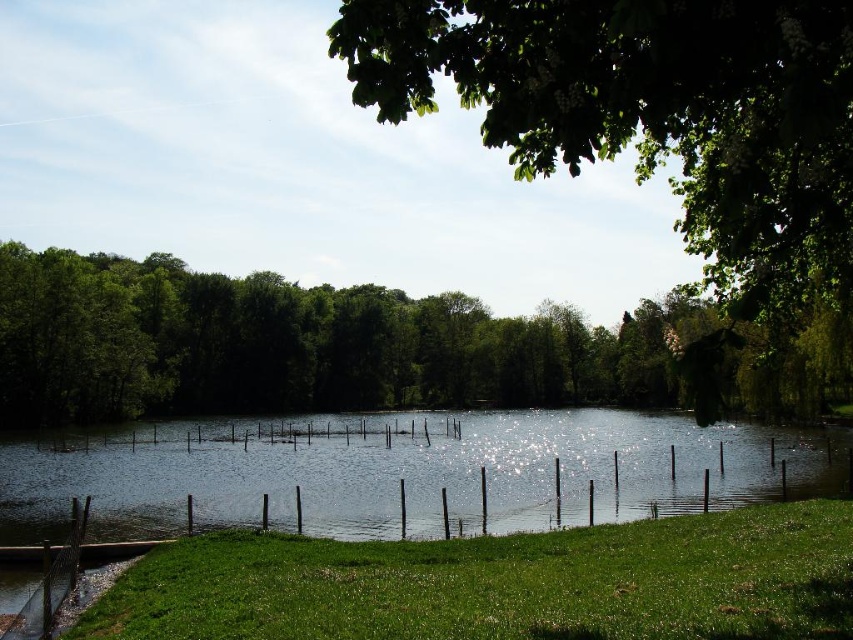
Does green leafy tree at upper right appear under green grass at lower left?

No.

This screenshot has height=640, width=853. What do you see at coordinates (653, 122) in the screenshot? I see `green leafy tree at upper right` at bounding box center [653, 122].

Where is `green leafy tree at upper right`? green leafy tree at upper right is located at coordinates (653, 122).

Between point (811, 323) and point (320, 419), which one is positioned behind?

Positioned behind is point (320, 419).

Does point (16, 284) lie behind point (207, 508)?

Yes.

The image size is (853, 640). I want to click on green leafy tree at center, so click(x=373, y=348).

The width and height of the screenshot is (853, 640). I want to click on green leafy tree at center, so click(x=373, y=348).

Who is shorter, green leafy tree at upper right or clear water at center?

green leafy tree at upper right

Between point (577, 40) and point (717, 461), which one is positioned behind?

The point (717, 461) is behind.

Where is `green leafy tree at upper right`? green leafy tree at upper right is located at coordinates (653, 122).